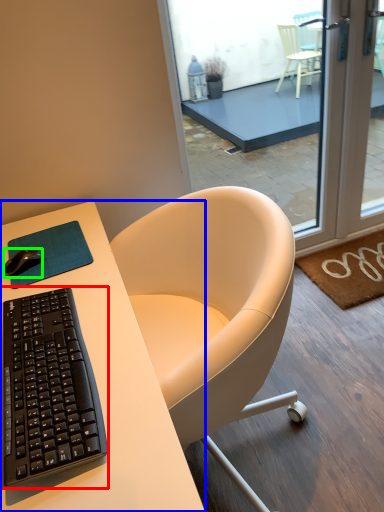
Question: Which is nearer to the computer keyboard (highlighted by a red box)? desk (highlighted by a blue box) or desk mouse (highlighted by a green box).

Choices:
 (A) desk
 (B) desk mouse

Answer: (A)